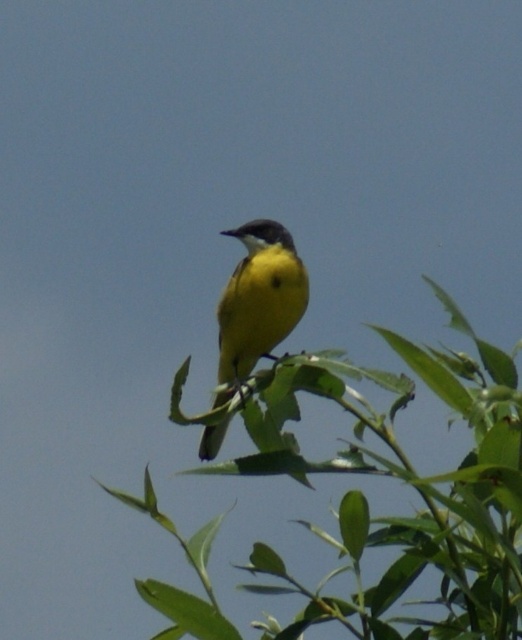
Does green leafy branch at center have a greater height compared to yellow matte bird at center?

Correct, green leafy branch at center is much taller as yellow matte bird at center.

Which of these two, green leafy branch at center or yellow matte bird at center, stands shorter?

With less height is yellow matte bird at center.

You are a GUI agent. You are given a task and a screenshot of the screen. Output one action in this format:
    pyautogui.click(x=<x>, y=<y>)
    Task: Click on the green leafy branch at center
    The image size is (522, 640).
    Given the screenshot: What is the action you would take?
    pyautogui.click(x=408, y=483)